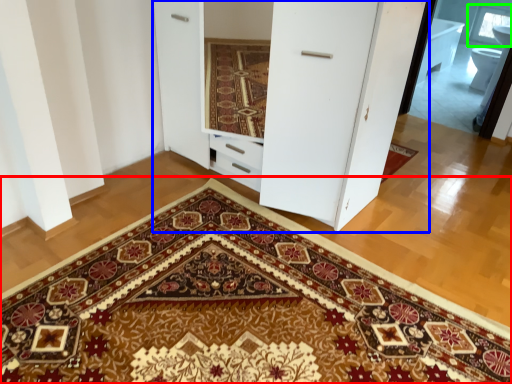
Question: Which object is the closest to the doormat (highlighted by a red box)? Choose among these: dresser (highlighted by a blue box) or window (highlighted by a green box).

Choices:
 (A) dresser
 (B) window

Answer: (A)